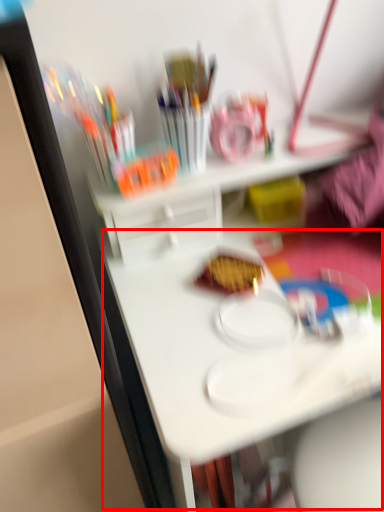
Question: Considering the relative positions of table (annotated by the red box) and food in the image provided, where is table (annotated by the red box) located with respect to the staircase?

Choices:
 (A) left
 (B) right

Answer: (B)